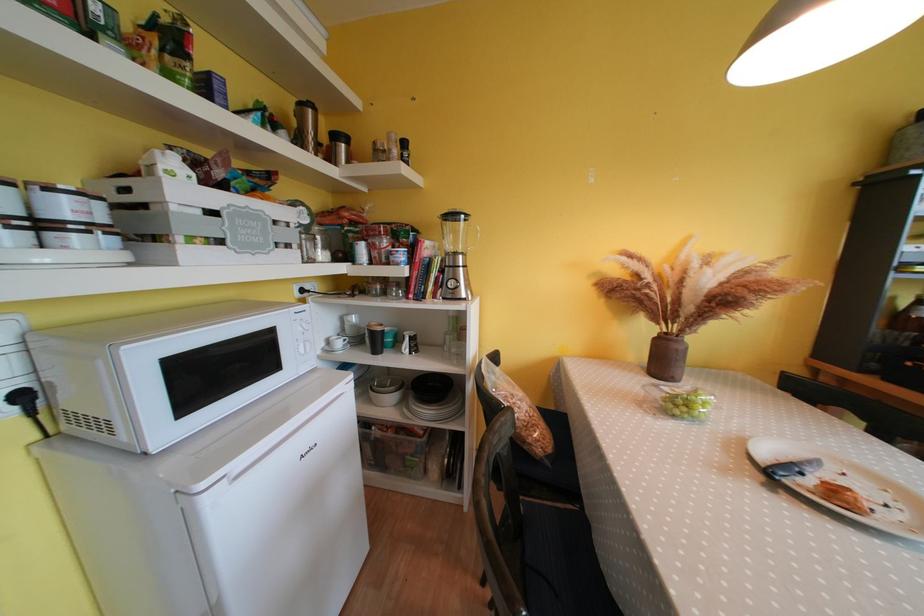
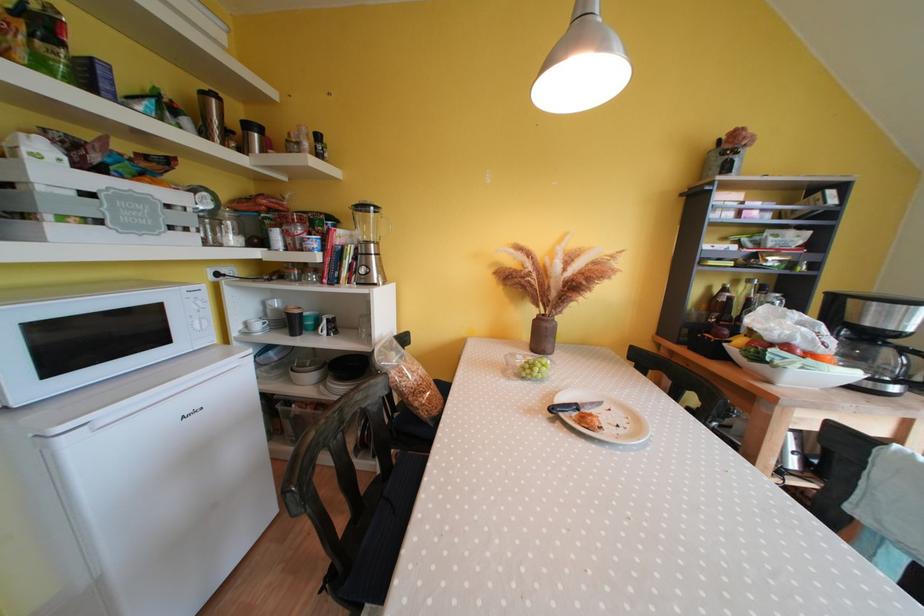
In the second image, find the point that corresponds to pixel 345 347 in the first image.

(264, 330)